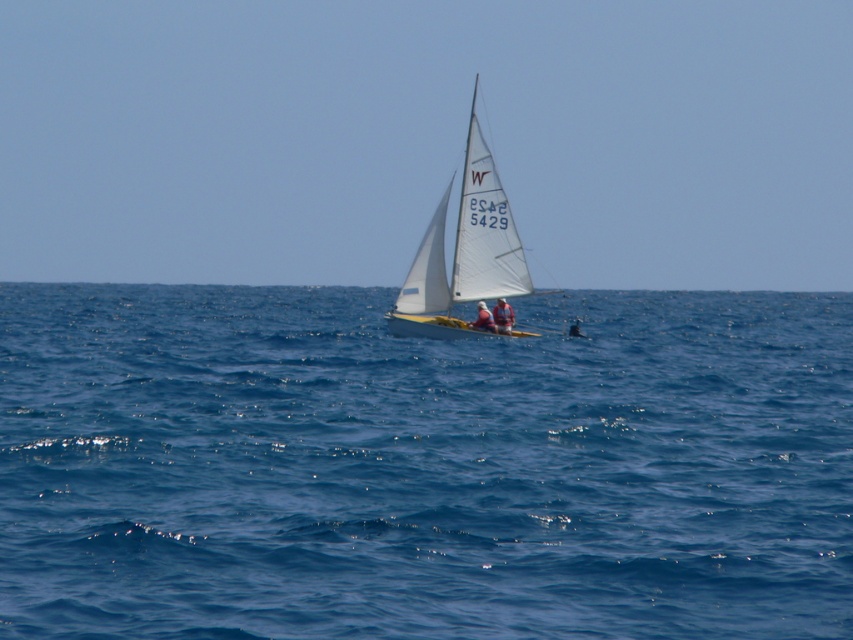
Is blue water at center further to camera compared to white sailboat at center?

No, blue water at center is in front of white sailboat at center.

Is point (773, 605) positioned before point (492, 237)?

Yes, point (773, 605) is closer to viewer.

Where is `blue water at center`? This screenshot has height=640, width=853. blue water at center is located at coordinates (421, 467).